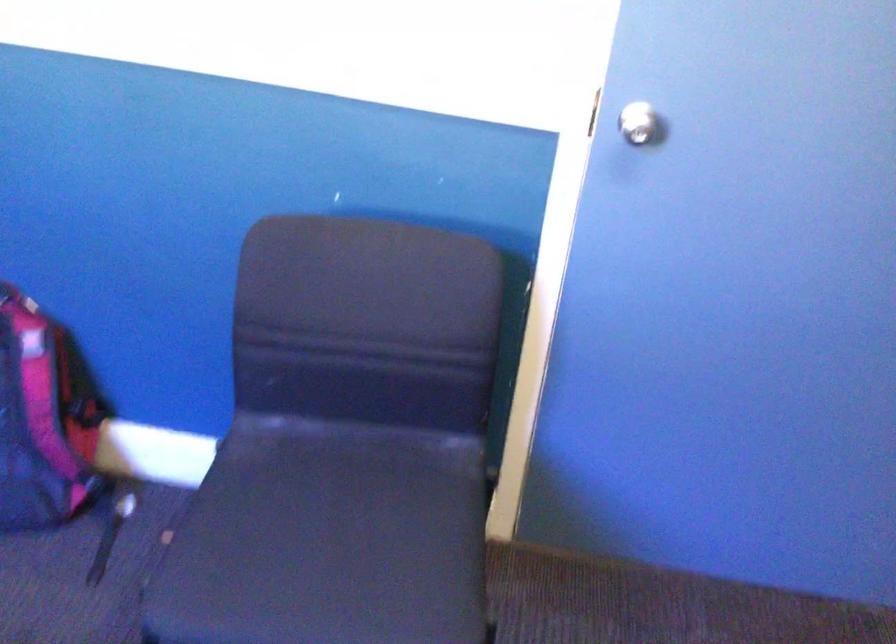
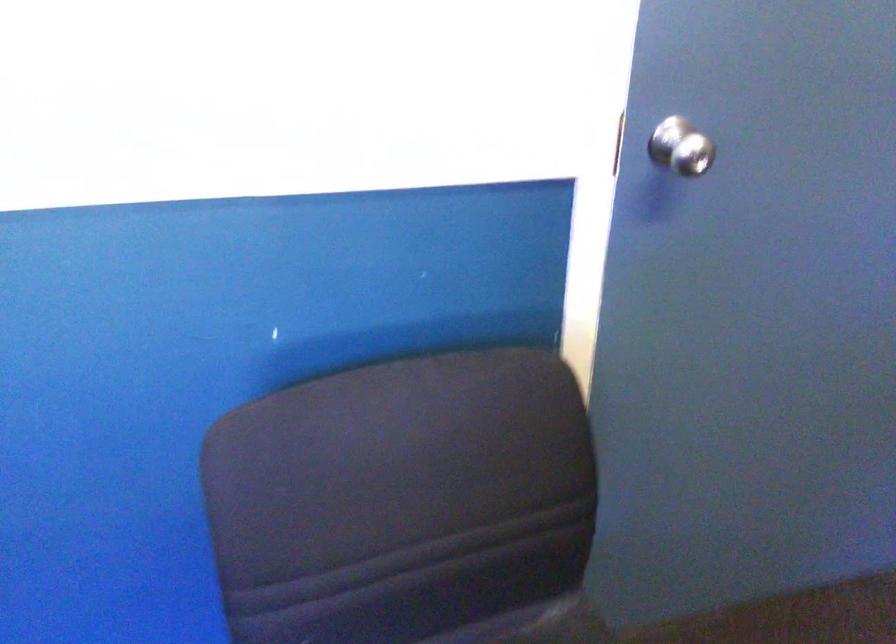
What movement of the cameraman would produce the second image?

The cameraman walked toward left, forward.